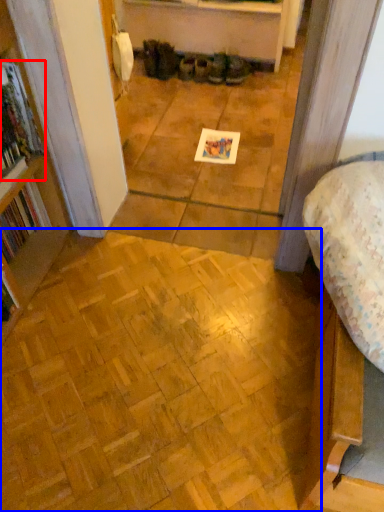
Question: Which object is closer to the camera taking this photo, book (highlighted by a red box) or plywood (highlighted by a blue box)?

Choices:
 (A) book
 (B) plywood

Answer: (B)